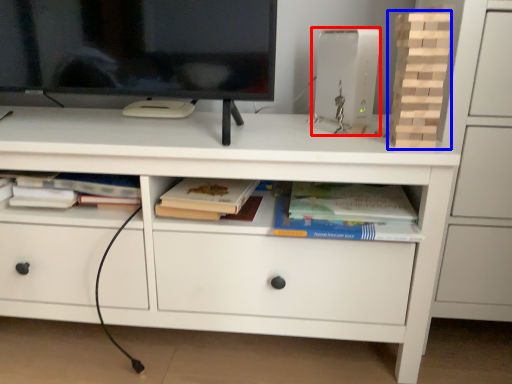
Question: Which object is further to the camera taking this photo, equipment (highlighted by a red box) or book (highlighted by a blue box)?

Choices:
 (A) equipment
 (B) book

Answer: (A)